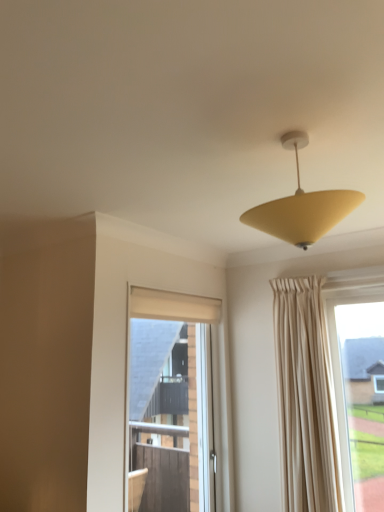
Question: From the image's perspective, is matte yellow cone at upper center under matte glass window at center?

Choices:
 (A) no
 (B) yes

Answer: (A)

Question: From a real-world perspective, is matte yellow cone at upper center under matte glass window at center?

Choices:
 (A) no
 (B) yes

Answer: (A)

Question: Does matte yellow cone at upper center have a greater height compared to matte glass window at center?

Choices:
 (A) no
 (B) yes

Answer: (A)

Question: Is the surface of matte yellow cone at upper center in direct contact with matte glass window at center?

Choices:
 (A) no
 (B) yes

Answer: (A)

Question: Considering the relative sizes of matte yellow cone at upper center and matte glass window at center in the image provided, is matte yellow cone at upper center shorter than matte glass window at center?

Choices:
 (A) yes
 (B) no

Answer: (A)

Question: Is matte yellow cone at upper center bigger than matte glass window at center?

Choices:
 (A) no
 (B) yes

Answer: (A)

Question: Is the surface of matte glass window at center in direct contact with matte yellow cone at upper center?

Choices:
 (A) no
 (B) yes

Answer: (A)

Question: From the image's perspective, is matte glass window at center below matte yellow cone at upper center?

Choices:
 (A) yes
 (B) no

Answer: (A)

Question: Does matte glass window at center have a larger size compared to matte yellow cone at upper center?

Choices:
 (A) yes
 (B) no

Answer: (A)

Question: Is matte glass window at center positioned far away from matte yellow cone at upper center?

Choices:
 (A) yes
 (B) no

Answer: (A)

Question: From a real-world perspective, is matte glass window at center positioned under matte yellow cone at upper center based on gravity?

Choices:
 (A) no
 (B) yes

Answer: (B)

Question: From the image's perspective, is matte glass window at center on matte yellow cone at upper center?

Choices:
 (A) yes
 (B) no

Answer: (B)

Question: Which is correct: matte yellow cone at upper center is inside matte glass window at center, or outside of it?

Choices:
 (A) inside
 (B) outside

Answer: (B)